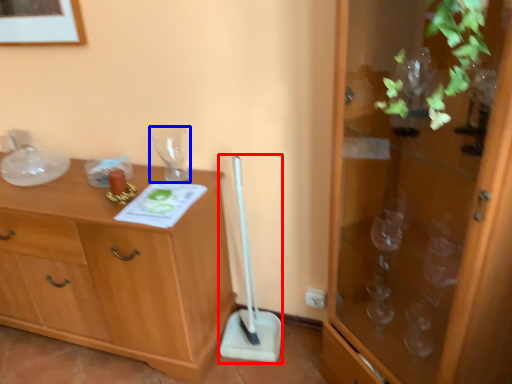
Question: Which object is further to the camera taking this photo, shovel (highlighted by a red box) or glass vase (highlighted by a blue box)?

Choices:
 (A) shovel
 (B) glass vase

Answer: (B)